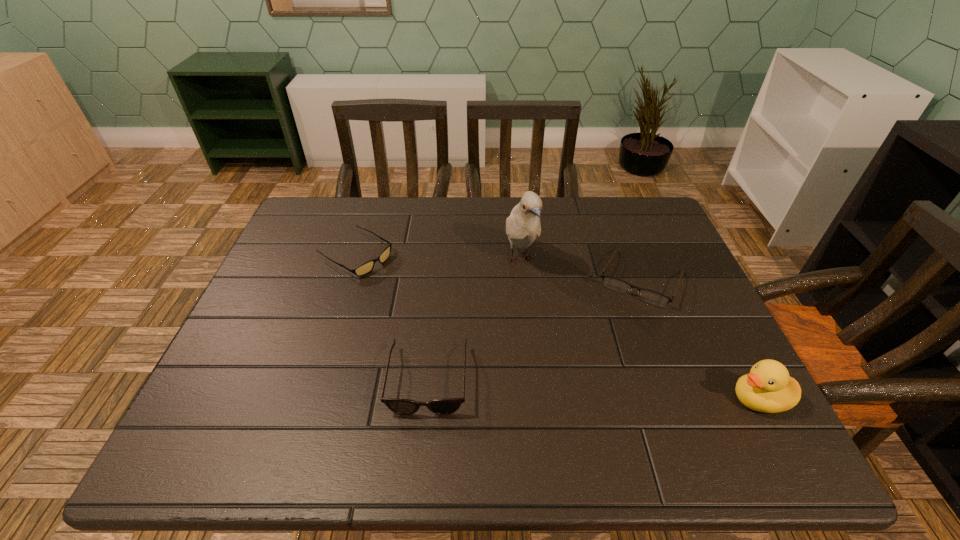
You are a GUI agent. You are given a task and a screenshot of the screen. Output one action in this format:
    pyautogui.click(x=<x>, y=<y>)
    Task: Click on the free space at the near edge of the desktop
    This screenshot has width=960, height=540.
    Given the screenshot: What is the action you would take?
    pyautogui.click(x=308, y=399)

Find the location of a particular element. The image size is (960, 540). vacant space at the left edge is located at coordinates (276, 272).

Locate an element on the screen. The image size is (960, 540). vacant area at the right edge is located at coordinates (684, 268).

Locate an element on the screen. free space at the far left corner is located at coordinates tap(347, 211).

Find the location of a particular element. The width and height of the screenshot is (960, 540). vacant space at the near left corner of the desktop is located at coordinates (228, 392).

Locate an element on the screen. free point between the spectacles and the nearer sunglasses is located at coordinates (535, 329).

I want to click on vacant area that lies between the third object from left to right and the spectacles, so click(581, 269).

The width and height of the screenshot is (960, 540). I want to click on vacant area between the third tallest object and the spectacles, so click(535, 329).

Find the location of a particular element. The width and height of the screenshot is (960, 540). free space between the left sunglasses and the second object from left to right is located at coordinates (393, 318).

Where is `free space between the bird and the leftmost object`? free space between the bird and the leftmost object is located at coordinates (439, 257).